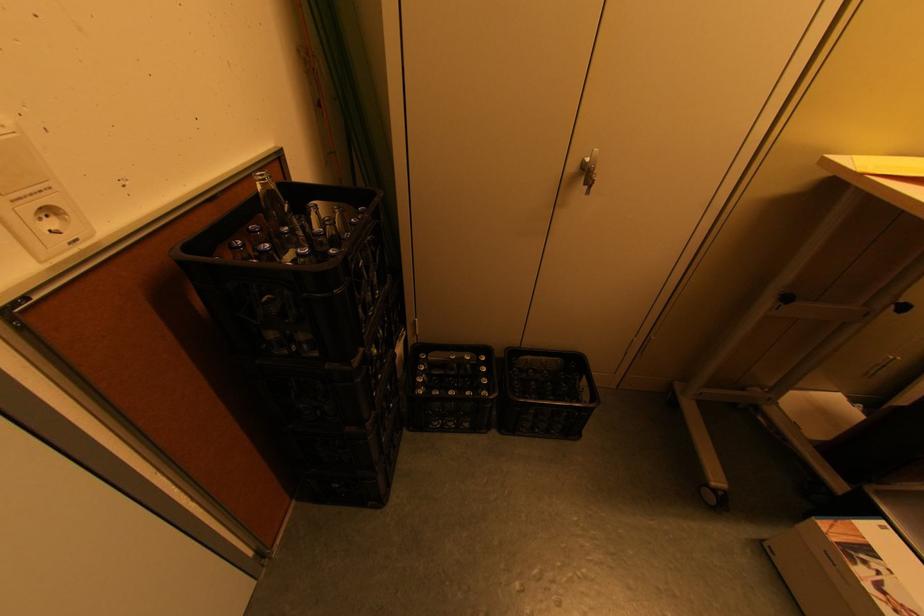
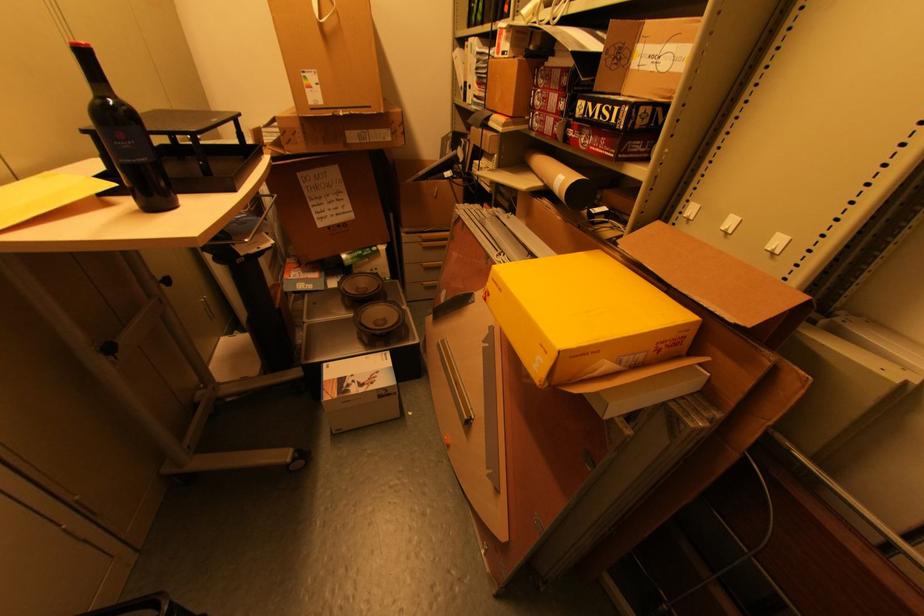
In the second image, find the point that corresponds to the point at 789,300 in the first image.

(114, 349)